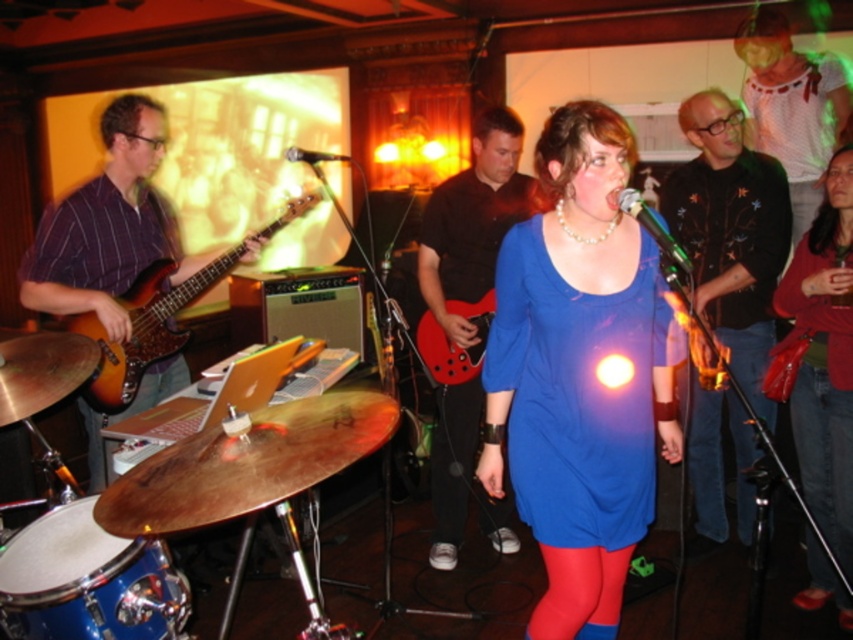
You are a stagehand preparing to place a new microphone stand in the empty space between the singer and the drummer. The singer is at the center, and the drummer is at the point labeled as point (88, 580). Where should you position the microphone stand to ensure it is equidistant from both?

The point equidistant from the singer at the center and the drummer at point (88, 580) would be along the perpendicular bisector of the line segment connecting them. However, since the drummer is at the lower left corner, the midpoint between the center and the lower left would be the optimal position for the microphone stand to maintain equal distance from both.

You are standing in the audience and want to throw a flower bouquet to the singer wearing the blue fabric dress at center. If the average throwing distance for a bouquet is 2 meters, will you be able to reach her?

The blue fabric dress at center and the viewer are 1.64 meters apart. Since the average throwing distance is 2 meters, you can successfully throw the flower bouquet to reach the singer wearing the blue fabric dress at center.

You are a photographer standing at the camera position. You want to hand your camera to the person wearing the black leather jacket at upper right. Can you reach them without moving your feet?

The black leather jacket at upper right and camera are 2.64 meters apart from each other, so the photographer cannot reach them without moving since the distance is too far.